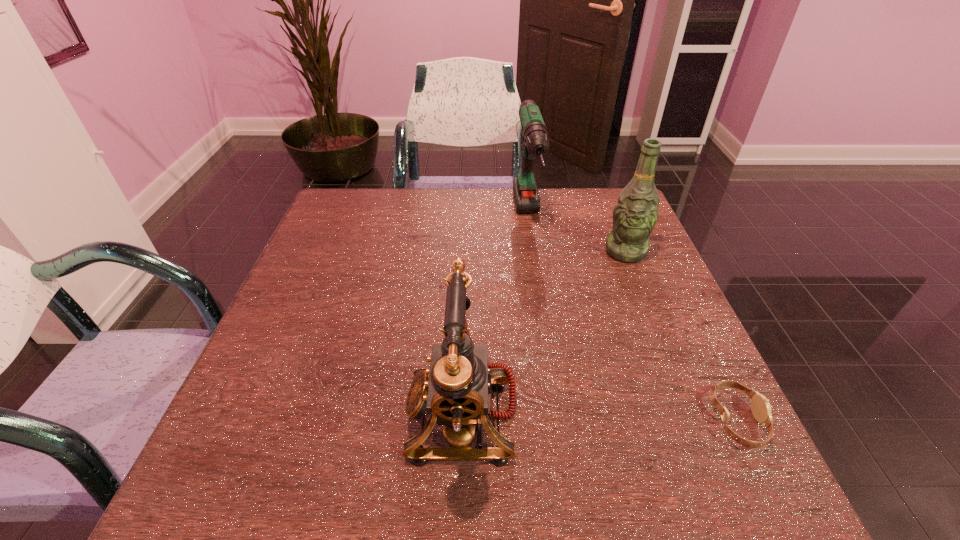
Identify the location of vacant space on the desktop that is between the leftmost object and the shortest object and is positioned on the surface of the beer bottle. (590, 417).

Identify the location of vacant spot on the desktop that is between the telephone and the watch and is positioned on the handle side of the drill. This screenshot has width=960, height=540. (565, 417).